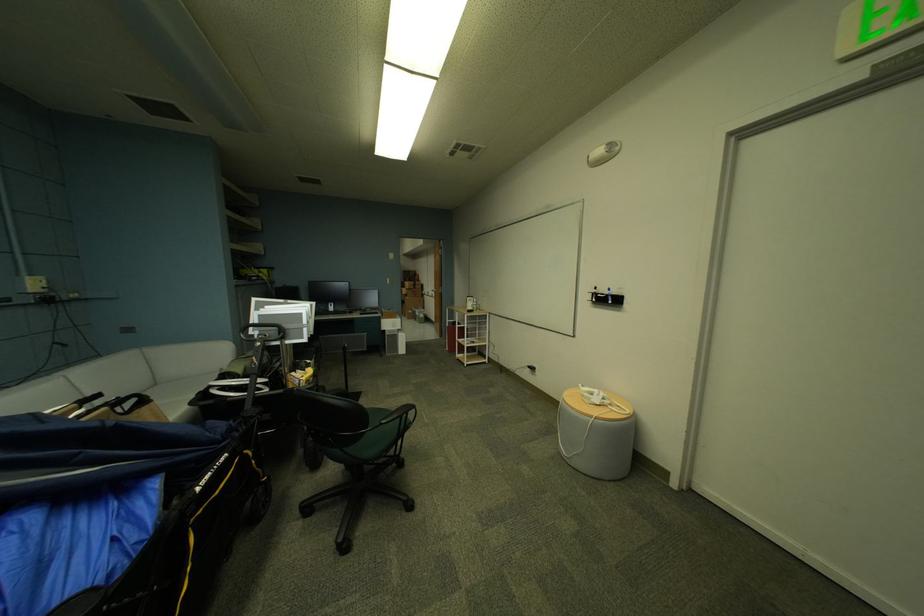
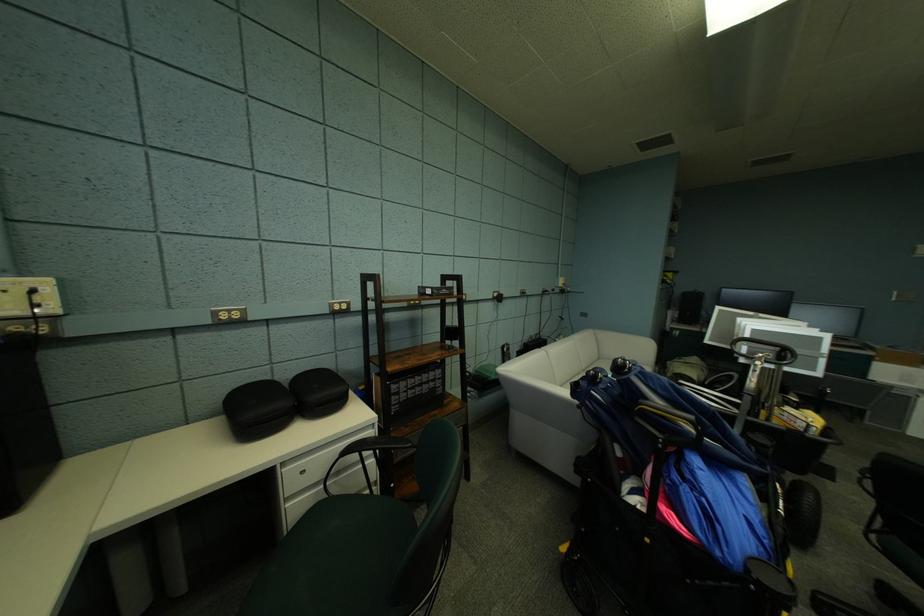
Where in the second image is the point corresponding to pixel 268 333 from the first image?

(758, 349)